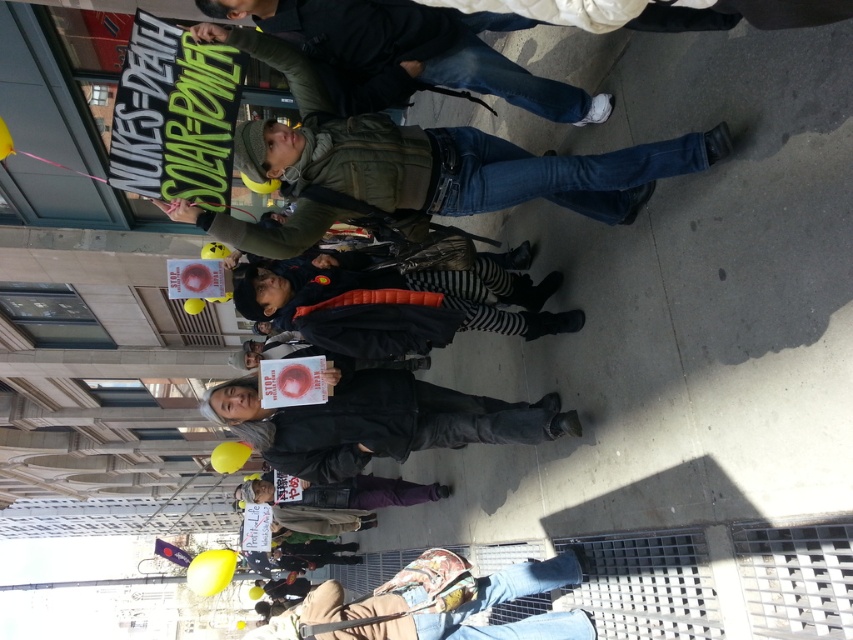
You are a photographer trying to capture the protest scene. You notice the denim jeans at upper center in the image. Based on its coordinates, where exactly is this person positioned relative to the other protesters?

The denim jeans at upper center is located at point [410,52], which places it near the top left corner of the image, making the person appear to be at the front of the protest group.

You are a photographer standing at the edge of the protest scene. You want to capture a photo of the gray fabric jacket at center without including the sign that reads NUKES DEATH. Is the jacket positioned in a way that allows this?

The gray fabric jacket at center is located at point (376,420), which is separate from the sign reading NUKES DEATH. Therefore, it can be photographed without including the sign.